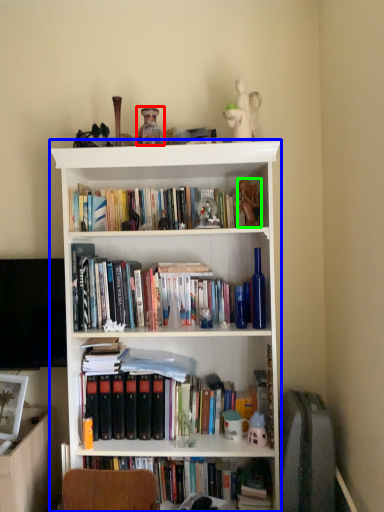
Question: Which is farther away from toy (highlighted by a red box)? bookcase (highlighted by a blue box) or toy (highlighted by a green box)?

Choices:
 (A) bookcase
 (B) toy

Answer: (A)